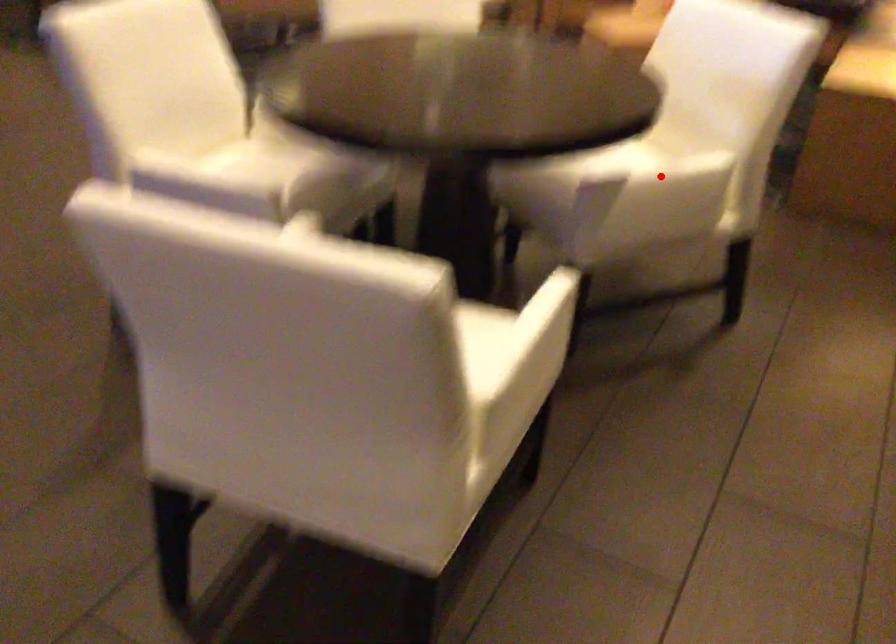
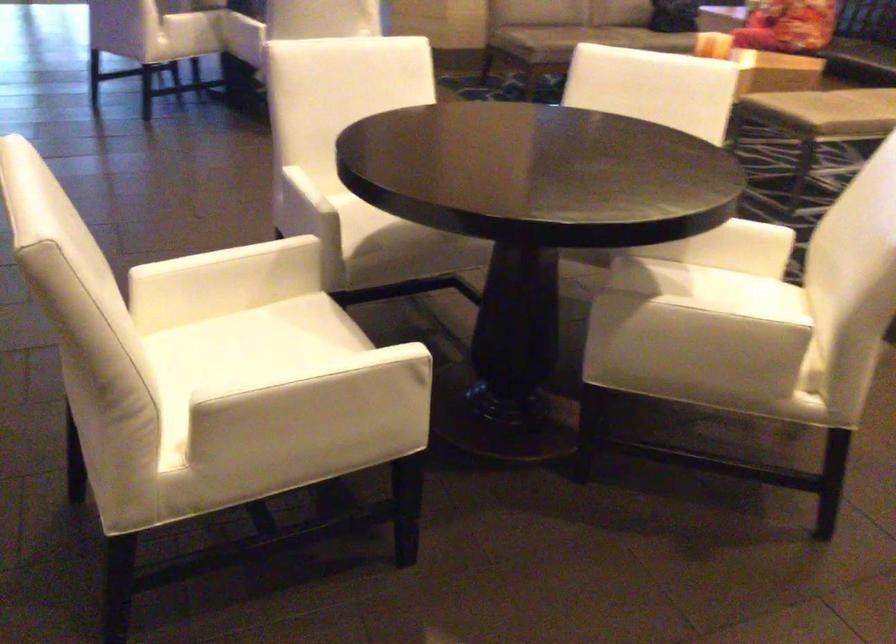
Question: A red point is marked in image1. In image2, is the corresponding 3D point closer to the camera or farther? Reply with the corresponding letter.

Choices:
 (A) The corresponding 3D point is closer.
 (B) The corresponding 3D point is farther.

Answer: (A)